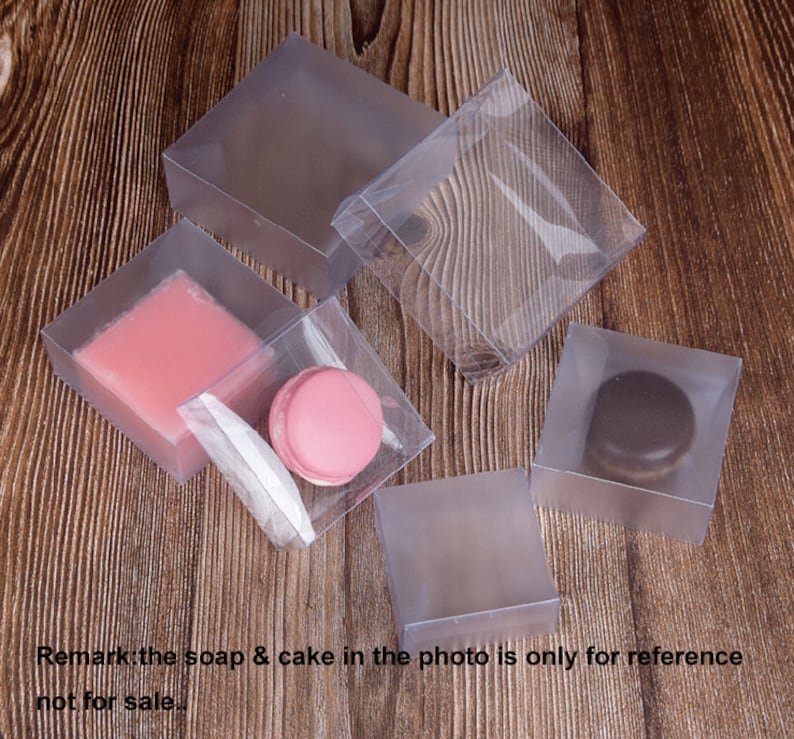
Where is `box`? The width and height of the screenshot is (794, 739). box is located at coordinates (255, 292).